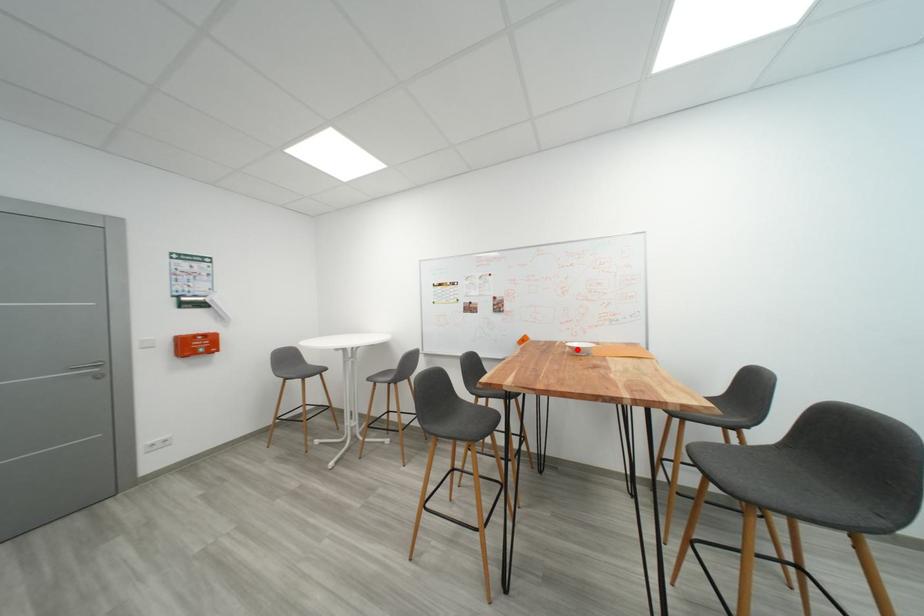
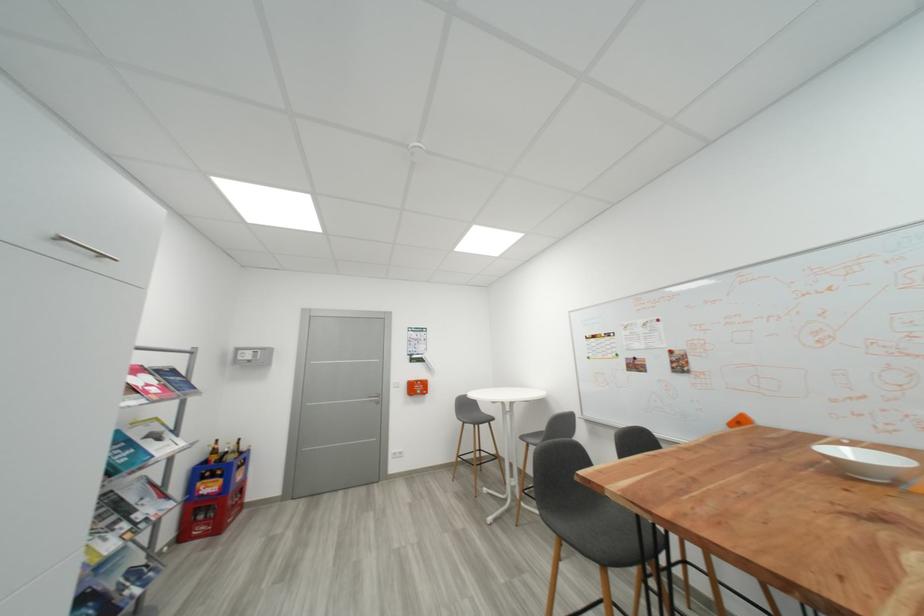
Find the pixel in the second image that matches the highlighted location in the first image.

(834, 458)